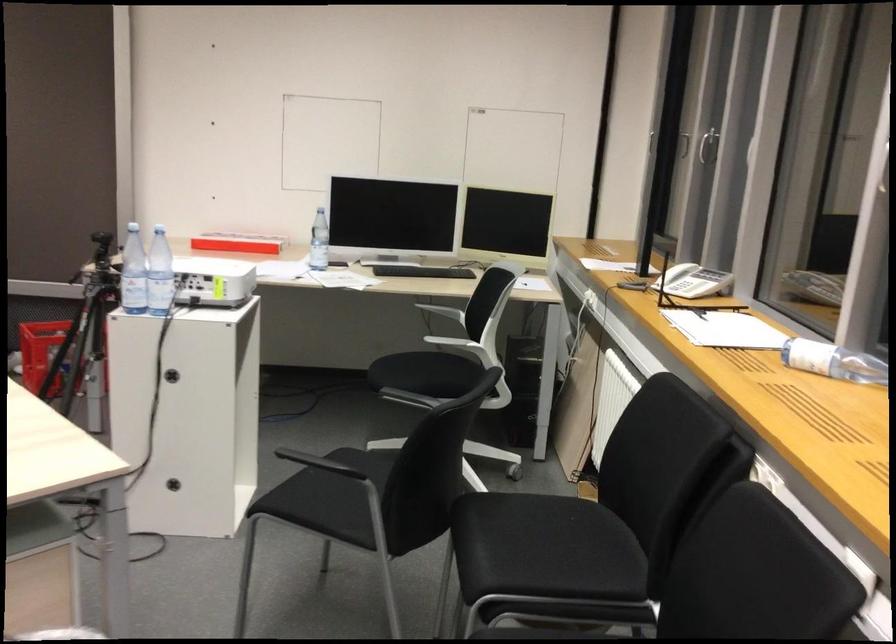
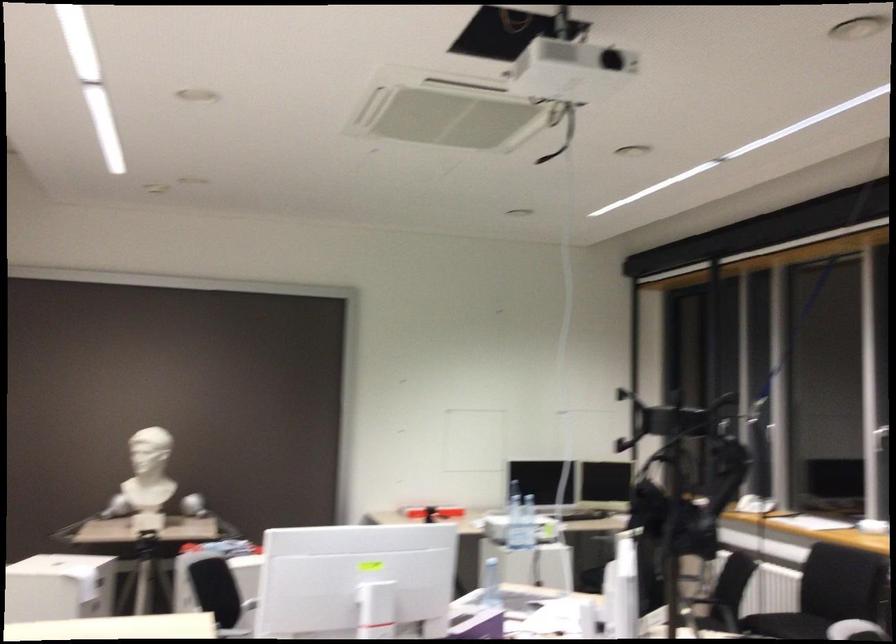
Which direction would the cameraman need to move to produce the second image?

The movement direction of the cameraman is left, backward.